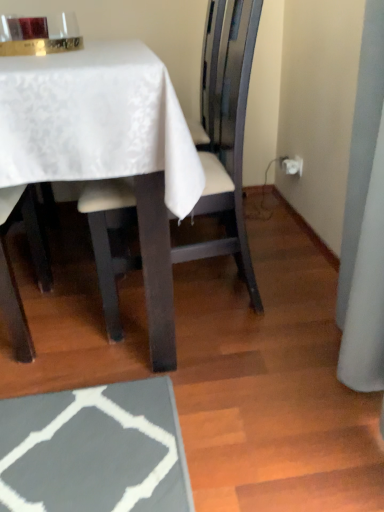
Question: Considering the relative positions of white satin table at upper left and white leather chair at center in the image provided, is white satin table at upper left in front of white leather chair at center?

Choices:
 (A) yes
 (B) no

Answer: (A)

Question: From the image's perspective, is white satin table at upper left beneath white leather chair at center?

Choices:
 (A) no
 (B) yes

Answer: (A)

Question: Is white satin table at upper left located outside white leather chair at center?

Choices:
 (A) no
 (B) yes

Answer: (B)

Question: Is white satin table at upper left taller than white leather chair at center?

Choices:
 (A) yes
 (B) no

Answer: (B)

Question: Can you confirm if white satin table at upper left is shorter than white leather chair at center?

Choices:
 (A) yes
 (B) no

Answer: (A)

Question: Can you confirm if white satin table at upper left is positioned to the right of white leather chair at center?

Choices:
 (A) yes
 (B) no

Answer: (B)

Question: Is white leather chair at center behind white satin table at upper left?

Choices:
 (A) no
 (B) yes

Answer: (B)

Question: From the image's perspective, is white leather chair at center beneath white satin table at upper left?

Choices:
 (A) no
 (B) yes

Answer: (B)

Question: Is white leather chair at center smaller than white satin table at upper left?

Choices:
 (A) yes
 (B) no

Answer: (A)

Question: Could you tell me if white leather chair at center is turned towards white satin table at upper left?

Choices:
 (A) no
 (B) yes

Answer: (B)

Question: Can you confirm if white leather chair at center is positioned to the left of white satin table at upper left?

Choices:
 (A) yes
 (B) no

Answer: (B)

Question: Considering the relative sizes of white leather chair at center and white satin table at upper left in the image provided, is white leather chair at center shorter than white satin table at upper left?

Choices:
 (A) yes
 (B) no

Answer: (B)

Question: Relative to white satin table at upper left, is white leather chair at center in front or behind?

Choices:
 (A) front
 (B) behind

Answer: (B)